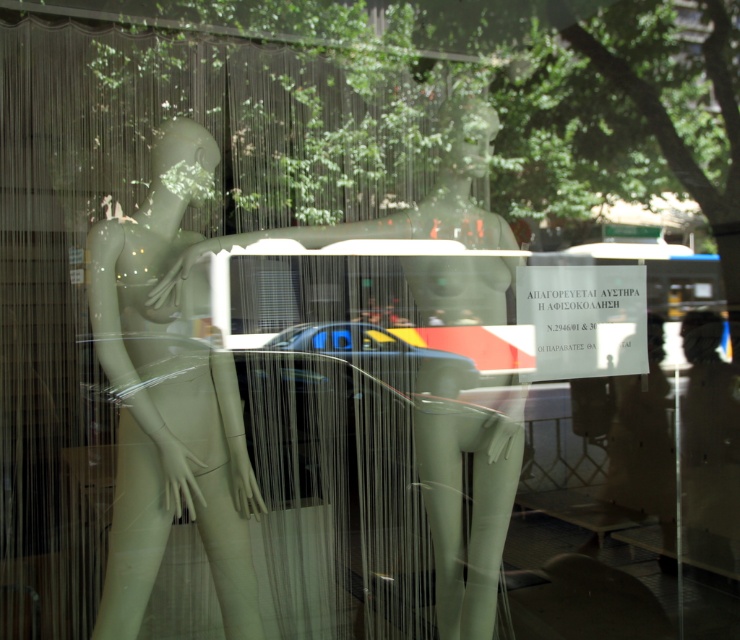
Who is positioned more to the right, matte white mannequin at left or matte white mannequin at center?

Positioned to the right is matte white mannequin at center.

Describe the element at coordinates (169, 397) in the screenshot. I see `matte white mannequin at left` at that location.

The width and height of the screenshot is (740, 640). I want to click on matte white mannequin at left, so click(x=169, y=397).